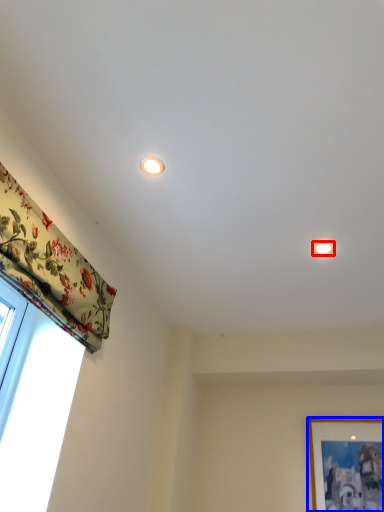
Question: Which object appears closest to the camera in this image, lighting (highlighted by a red box) or picture frame (highlighted by a blue box)?

Choices:
 (A) lighting
 (B) picture frame

Answer: (A)